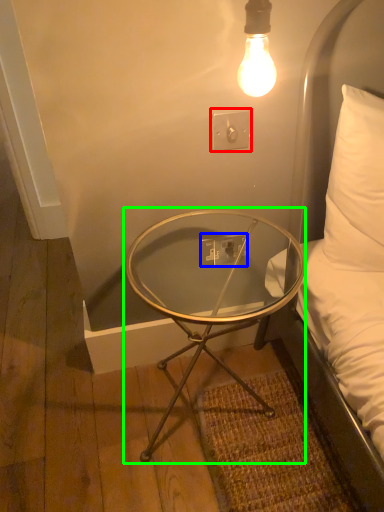
Question: Considering the real-world distances, which object is farthest from electric outlet (highlighted by a red box)? electric outlet (highlighted by a blue box) or coffee table (highlighted by a green box)?

Choices:
 (A) electric outlet
 (B) coffee table

Answer: (B)